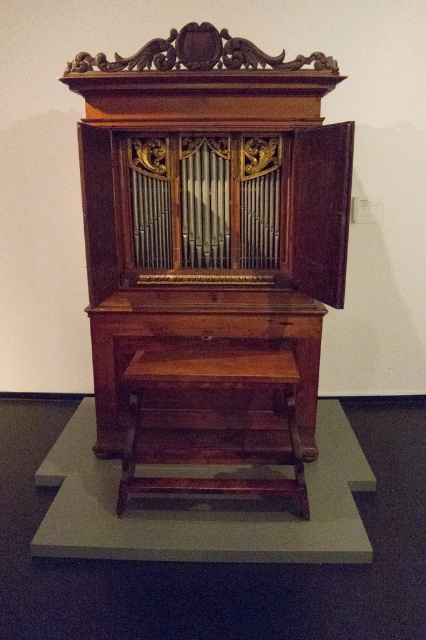
Question: Is polished wood pipe organ at center positioned in front of wooden stool at center?

Choices:
 (A) yes
 (B) no

Answer: (A)

Question: Can you confirm if polished wood pipe organ at center is wider than wooden stool at center?

Choices:
 (A) yes
 (B) no

Answer: (A)

Question: Which point is closer to the camera taking this photo?

Choices:
 (A) (316, 384)
 (B) (132, 486)

Answer: (B)

Question: Which point appears closest to the camera in this image?

Choices:
 (A) (282, 349)
 (B) (132, 332)

Answer: (B)

Question: Does polished wood pipe organ at center appear over wooden stool at center?

Choices:
 (A) no
 (B) yes

Answer: (B)